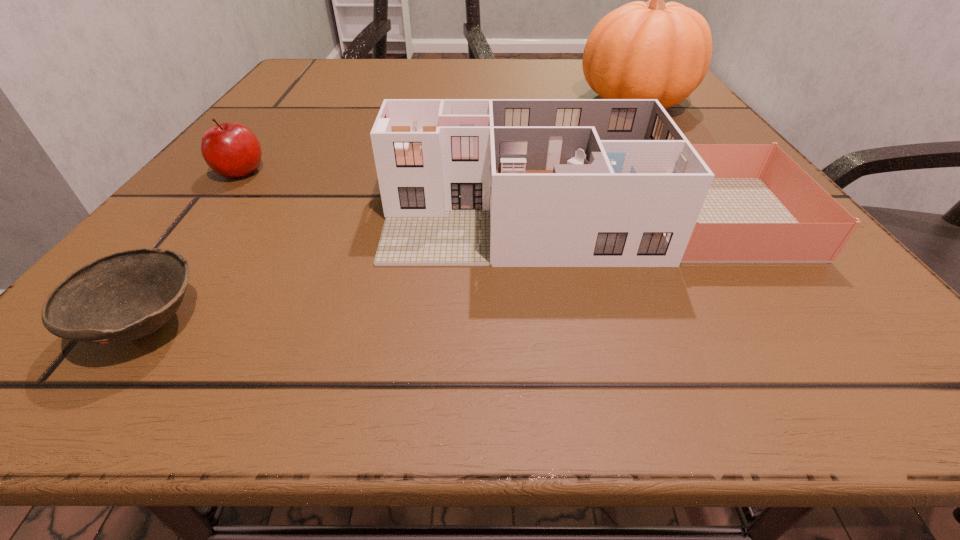
Where is `vacant region located 0.310m on the back of the second shortest object`? This screenshot has height=540, width=960. vacant region located 0.310m on the back of the second shortest object is located at coordinates (306, 89).

This screenshot has width=960, height=540. Identify the location of vacant region located 0.230m on the right of the nearest object. (423, 324).

Find the location of a particular element. object at the far edge is located at coordinates (642, 50).

In order to click on object positioned at the near edge in this screenshot , I will do `click(124, 296)`.

At what (x,y) coordinates should I click in order to perform the action: click on apple that is at the left edge. Please return your answer as a coordinate pair (x, y). Looking at the image, I should click on (230, 149).

I want to click on bowl present at the left edge, so click(x=124, y=296).

Where is `pumpkin that is at the right edge`? pumpkin that is at the right edge is located at coordinates (642, 50).

Where is `dollhouse present at the right edge`? This screenshot has width=960, height=540. dollhouse present at the right edge is located at coordinates (464, 182).

The height and width of the screenshot is (540, 960). In order to click on object at the near left corner in this screenshot , I will do `click(124, 296)`.

The image size is (960, 540). What are the coordinates of `object present at the far right corner` in the screenshot? It's located at (642, 50).